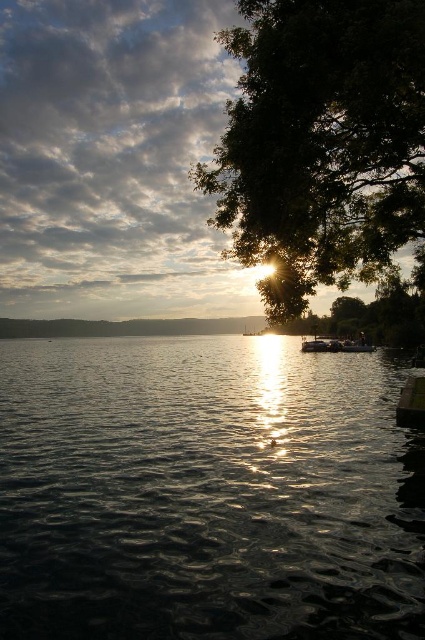
Question: Which object is farther from the camera taking this photo?

Choices:
 (A) green leafy tree at upper right
 (B) glistening dark water at center

Answer: (A)

Question: Which of the following is the farthest from the observer?

Choices:
 (A) glistening dark water at center
 (B) green leafy tree at upper right

Answer: (B)

Question: From the image, what is the correct spatial relationship of glistening dark water at center in relation to green leafy tree at upper right?

Choices:
 (A) right
 (B) left

Answer: (B)

Question: Where is glistening dark water at center located in relation to green leafy tree at upper right in the image?

Choices:
 (A) right
 (B) left

Answer: (B)

Question: Can you confirm if glistening dark water at center is bigger than green leafy tree at upper right?

Choices:
 (A) no
 (B) yes

Answer: (A)

Question: Which point is closer to the camera?

Choices:
 (A) green leafy tree at upper right
 (B) glistening dark water at center

Answer: (B)